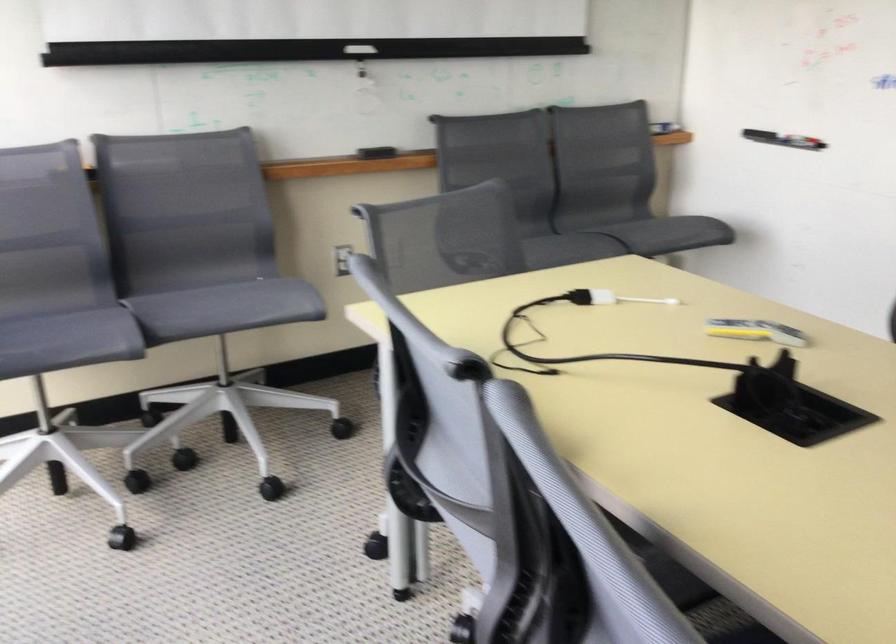
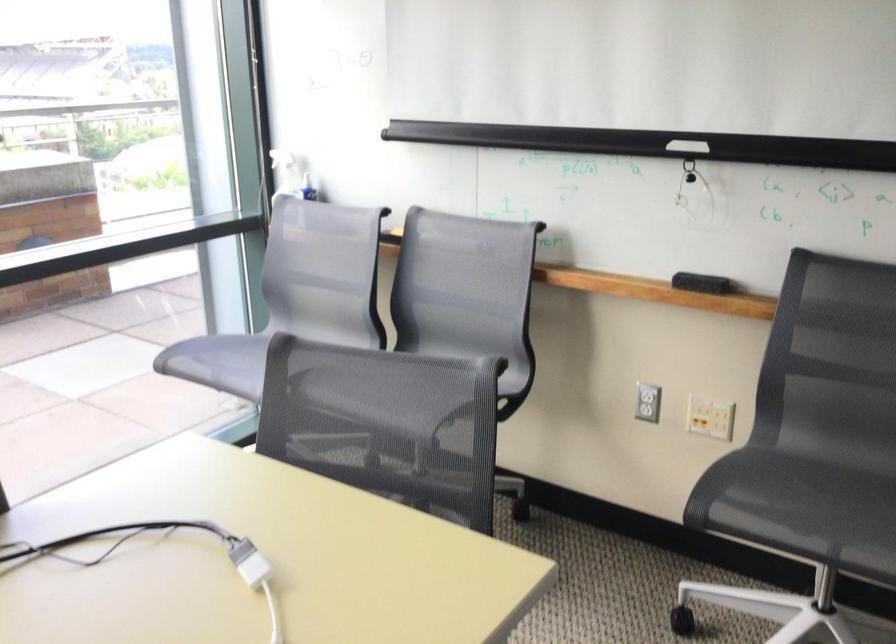
The point at (540, 328) is marked in the first image. Where is the corresponding point in the second image?

(161, 554)